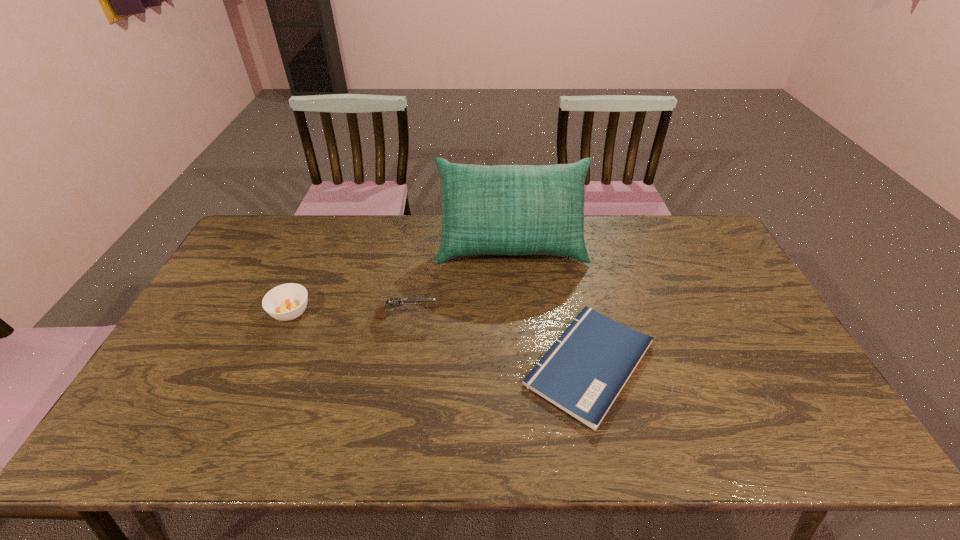
Where is `free spot between the paperback book and the soup bowl`? Image resolution: width=960 pixels, height=540 pixels. free spot between the paperback book and the soup bowl is located at coordinates (440, 338).

Locate an element on the screen. This screenshot has width=960, height=540. vacant area that lies between the leftmost object and the shortest object is located at coordinates (440, 338).

I want to click on free space that is in between the second shortest object and the gun, so click(x=348, y=315).

At what (x,y) coordinates should I click in order to perform the action: click on unoccupied area between the paperback book and the tallest object. Please return your answer as a coordinate pair (x, y). Looking at the image, I should click on (550, 305).

Identify the location of unoccupied position between the farthest object and the soup bowl. (401, 279).

At what (x,y) coordinates should I click in order to perform the action: click on unoccupied position between the tallest object and the paperback book. Please return your answer as a coordinate pair (x, y). Looking at the image, I should click on (550, 305).

At what (x,y) coordinates should I click in order to perform the action: click on vacant space that's between the cushion and the leftmost object. Please return your answer as a coordinate pair (x, y). Looking at the image, I should click on (401, 279).

In order to click on empty location between the gun and the leftmost object in this screenshot , I will do `click(348, 315)`.

This screenshot has width=960, height=540. I want to click on the closest object to the third tallest object, so click(x=390, y=303).

Identify which object is the third nearest to the shortest object. Please provide its 2D coordinates. Your answer should be formatted as a tuple, i.e. [(x, y)], where the tuple contains the x and y coordinates of a point satisfying the conditions above.

[(286, 302)]